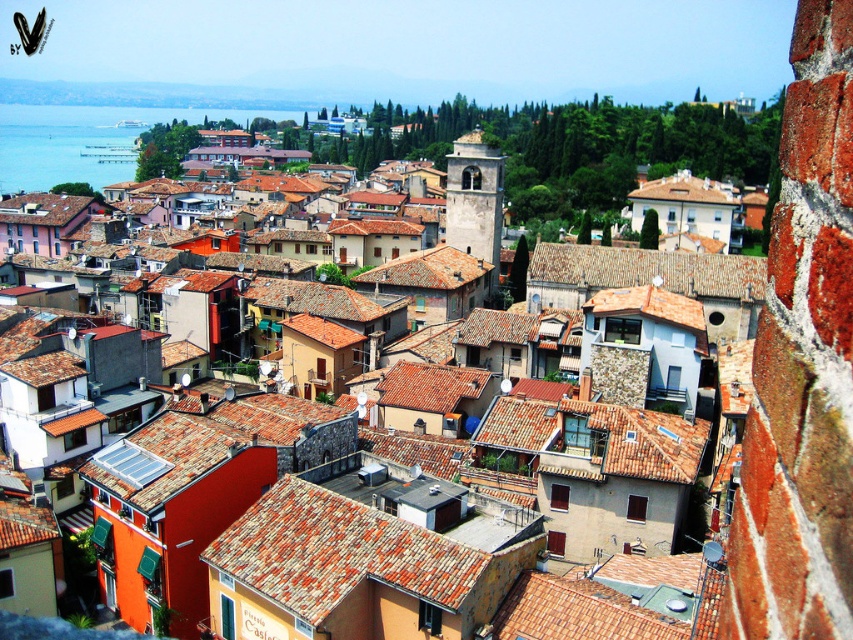
Can you confirm if brown clay roof tiles at center is taller than blue water at left?

No, brown clay roof tiles at center is not taller than blue water at left.

Does brown clay roof tiles at center have a lesser width compared to blue water at left?

Yes.

In order to click on brown clay roof tiles at center in this screenshot , I will do `click(614, 420)`.